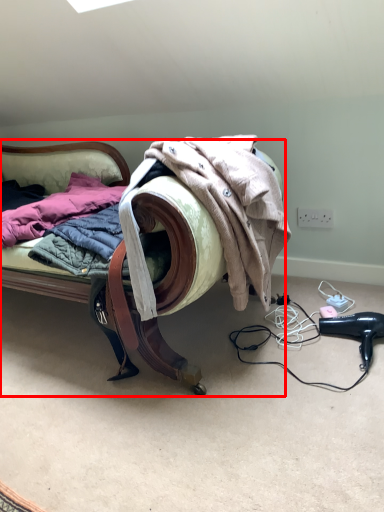
Question: From the image's perspective, considering the relative positions of furniture (annotated by the red box) and hair drier in the image provided, where is furniture (annotated by the red box) located with respect to the staircase?

Choices:
 (A) below
 (B) above

Answer: (B)